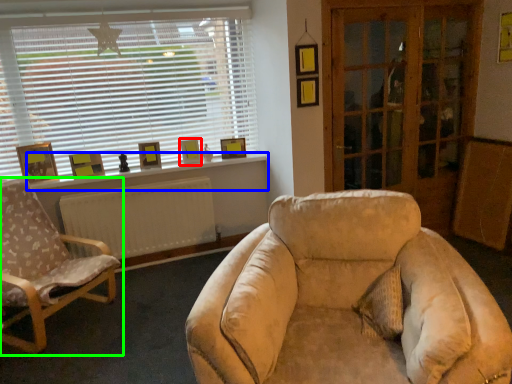
Question: Which is farther away from picture frame (highlighted by a red box)? window sill (highlighted by a blue box) or chair (highlighted by a green box)?

Choices:
 (A) window sill
 (B) chair

Answer: (B)